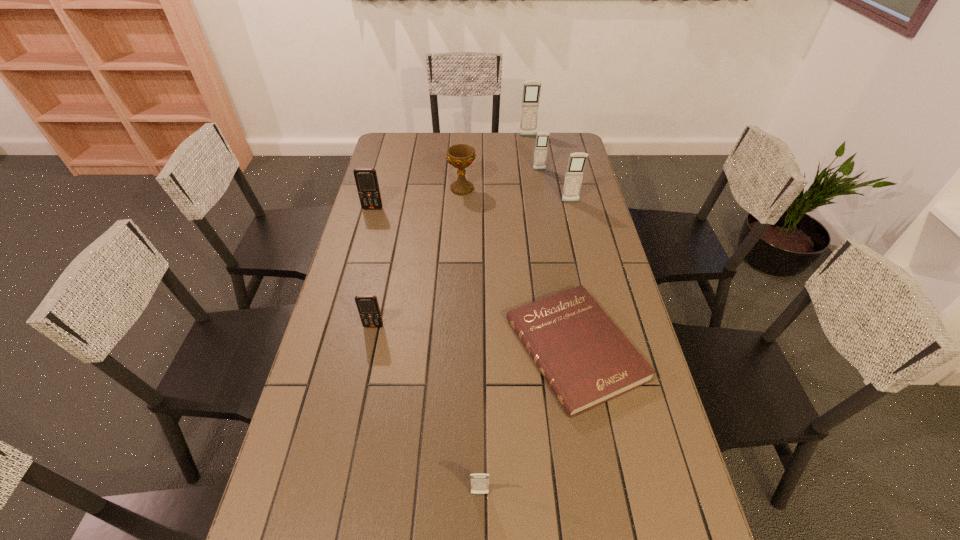
In order to click on the farthest gray cellular telephone in this screenshot , I will do `click(531, 89)`.

Where is `the tallest cellular telephone`? This screenshot has height=540, width=960. the tallest cellular telephone is located at coordinates (531, 89).

The height and width of the screenshot is (540, 960). In order to click on the fifth nearest object in this screenshot , I will do [577, 161].

Locate an element on the screen. The width and height of the screenshot is (960, 540). the third farthest gray cellular telephone is located at coordinates (577, 161).

Find the location of a particular element. The height and width of the screenshot is (540, 960). the seventh nearest object is located at coordinates (x=542, y=139).

Image resolution: width=960 pixels, height=540 pixels. I want to click on the third biggest gray cellular telephone, so click(x=542, y=139).

You are a GUI agent. You are given a task and a screenshot of the screen. Output one action in this format:
    pyautogui.click(x=<x>, y=<y>)
    Task: Click on the leftmost object
    Image resolution: width=960 pixels, height=540 pixels.
    Given the screenshot: What is the action you would take?
    pyautogui.click(x=366, y=179)

Where is `the fourth nearest object`? Image resolution: width=960 pixels, height=540 pixels. the fourth nearest object is located at coordinates (366, 179).

Where is `the sixth nearest object`? the sixth nearest object is located at coordinates (461, 156).

This screenshot has height=540, width=960. Identify the location of chalice. (461, 156).